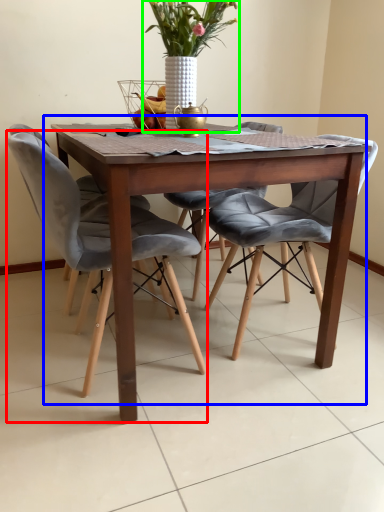
Question: Which object is the farthest from chair (highlighted by a red box)? Choose among these: kitchen & dining room table (highlighted by a blue box) or houseplant (highlighted by a green box).

Choices:
 (A) kitchen & dining room table
 (B) houseplant

Answer: (B)